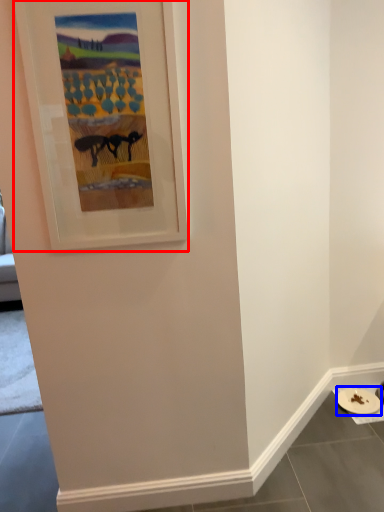
Question: Which point is further to the camera, picture frame (highlighted by a red box) or platter (highlighted by a blue box)?

Choices:
 (A) picture frame
 (B) platter

Answer: (B)